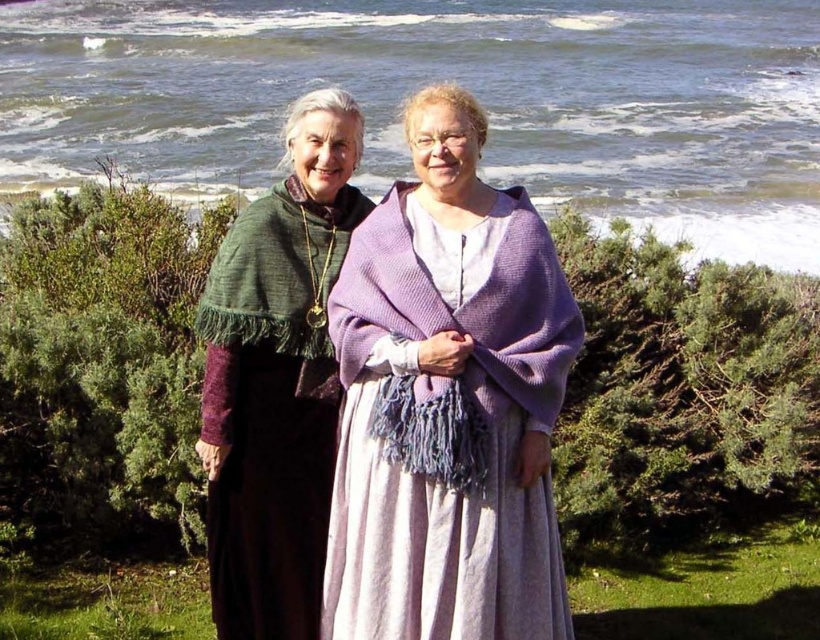
Between lavender knitted shawl at center and green knitted shawl at left, which one appears on the right side from the viewer's perspective?

lavender knitted shawl at center is more to the right.

Where is `lavender knitted shawl at center`? The height and width of the screenshot is (640, 820). lavender knitted shawl at center is located at coordinates (449, 403).